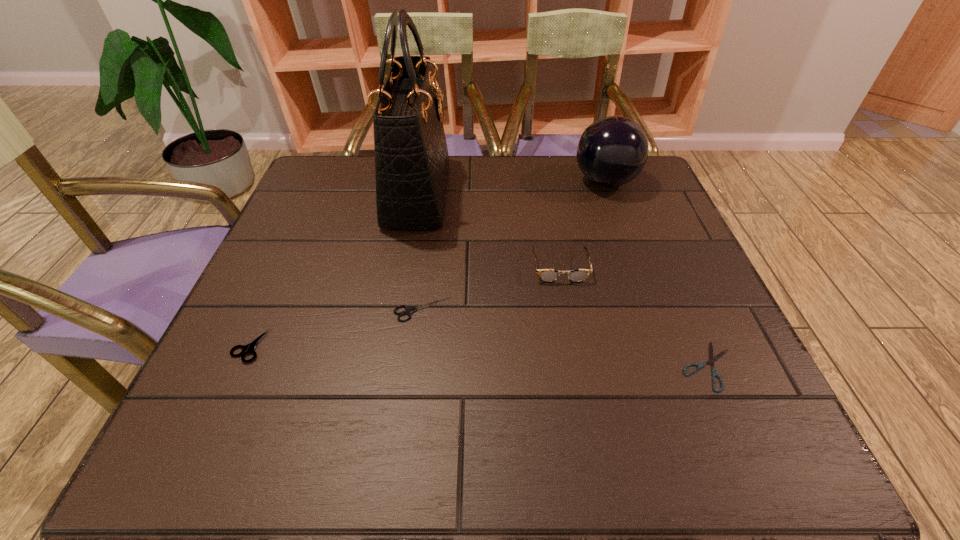
The width and height of the screenshot is (960, 540). I want to click on free space located at the front of the handbag with visible charms, so (x=485, y=193).

Locate an element on the screen. vacant region located 0.300m on the side of the bowling ball with the finger holes is located at coordinates (464, 182).

Find the location of a particular element. The width and height of the screenshot is (960, 540). blank space located on the side of the bowling ball with the finger holes is located at coordinates (445, 182).

Identify the location of free space located 0.100m on the side of the bowling ball with the finger holes. This screenshot has width=960, height=540. [x=537, y=182].

Image resolution: width=960 pixels, height=540 pixels. Find the location of `free space located 0.270m on the frame of the fourth object from left to right`. free space located 0.270m on the frame of the fourth object from left to right is located at coordinates (584, 397).

At what (x,y) coordinates should I click in order to perform the action: click on vacant region located 0.180m on the back of the leftmost shears. Please return your answer as a coordinate pair (x, y). The height and width of the screenshot is (540, 960). Looking at the image, I should click on (286, 265).

The image size is (960, 540). In order to click on vacant area located 0.250m on the left of the third nearest object in this screenshot , I will do `click(270, 309)`.

You are a GUI agent. You are given a task and a screenshot of the screen. Output one action in this format:
    pyautogui.click(x=<x>, y=<y>)
    Task: Click on the free space located 0.150m on the back of the shortest shears
    
    Given the screenshot: What is the action you would take?
    pyautogui.click(x=673, y=285)

Locate an element on the screen. Image resolution: width=960 pixels, height=540 pixels. handbag that is at the far edge is located at coordinates (411, 156).

The height and width of the screenshot is (540, 960). Find the location of `bowling ball positioned at the far edge`. bowling ball positioned at the far edge is located at coordinates (612, 151).